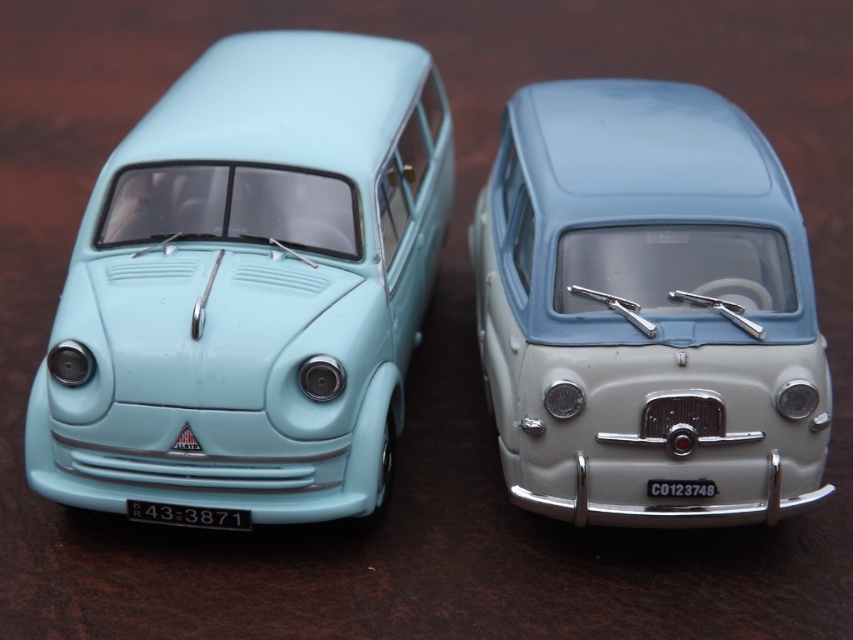
Which is in front, point (204, 336) or point (480, 332)?

Positioned in front is point (204, 336).

Between point (398, 170) and point (784, 234), which one is positioned behind?

The point (398, 170) is behind.

Between point (309, 300) and point (688, 122), which one is positioned in front?

Point (309, 300) is in front.

Find the location of a particular element. matte light blue van at left is located at coordinates (250, 289).